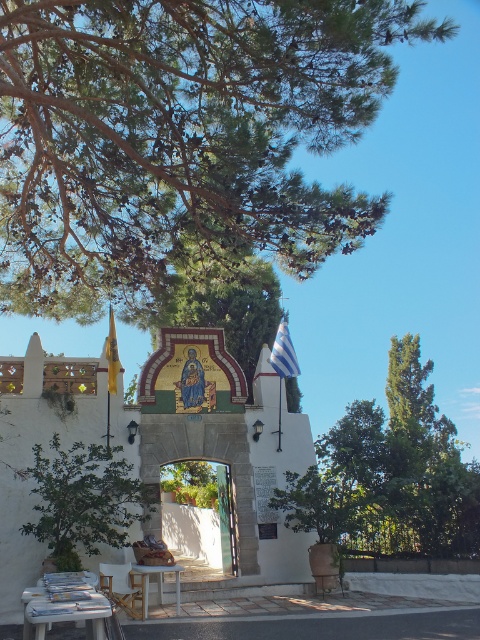
Does gold mosaic chapel at center have a lesser height compared to green leafy tree at right?

No, gold mosaic chapel at center is not shorter than green leafy tree at right.

Where is `gold mosaic chapel at center`? This screenshot has height=640, width=480. gold mosaic chapel at center is located at coordinates (220, 440).

This screenshot has height=640, width=480. What do you see at coordinates (220, 440) in the screenshot?
I see `gold mosaic chapel at center` at bounding box center [220, 440].

At what (x,y) coordinates should I click in order to perform the action: click on gold mosaic chapel at center. Please return your answer as a coordinate pair (x, y). The width and height of the screenshot is (480, 640). Looking at the image, I should click on (220, 440).

Does green needle-like leaves at upper center appear under white plastic picnic table at lower center?

Actually, green needle-like leaves at upper center is above white plastic picnic table at lower center.

Is point (269, 33) positioned before point (144, 586)?

Yes, point (269, 33) is closer to viewer.

Find the location of `green needle-like leaves at upper center`. green needle-like leaves at upper center is located at coordinates (180, 136).

Can you confirm if white wooden picnic table at lower left is wider than white plastic picnic table at lower center?

Yes, white wooden picnic table at lower left is wider than white plastic picnic table at lower center.

Measure the distance between white wooden picnic table at lower left and white plastic picnic table at lower center.

2.65 meters

Describe the element at coordinates (66, 604) in the screenshot. I see `white wooden picnic table at lower left` at that location.

What are the coordinates of `white wooden picnic table at lower left` in the screenshot? It's located at (66, 604).